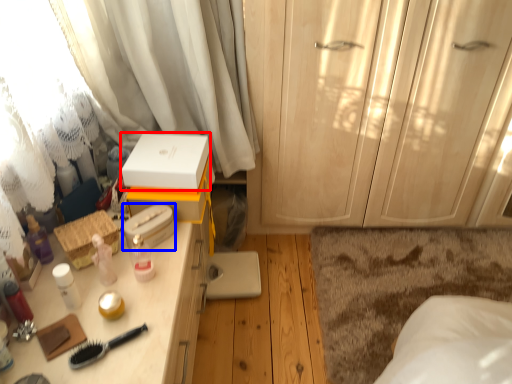
Question: Which object is further to the camera taking this photo, storage box (highlighted by a red box) or storage box (highlighted by a blue box)?

Choices:
 (A) storage box
 (B) storage box

Answer: (A)